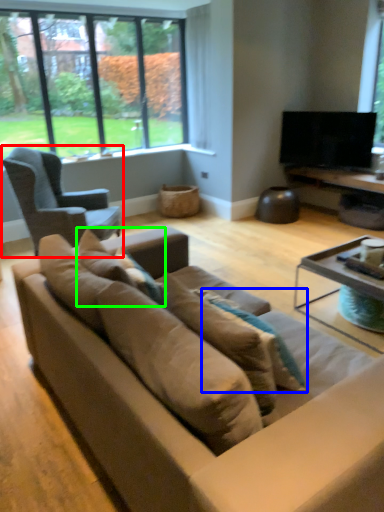
Question: Considering the real-world distances, which object is farthest from chair (highlighted by a red box)? pillow (highlighted by a blue box) or pillow (highlighted by a green box)?

Choices:
 (A) pillow
 (B) pillow

Answer: (A)